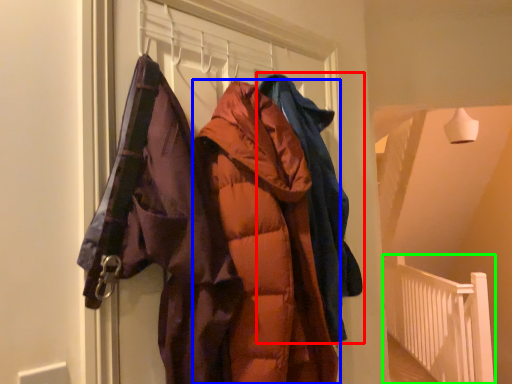
Question: Based on their relative distances, which object is farther from jacket (highlighted by a red box)? Choose from jacket (highlighted by a blue box) and balustrade (highlighted by a green box).

Choices:
 (A) jacket
 (B) balustrade

Answer: (B)